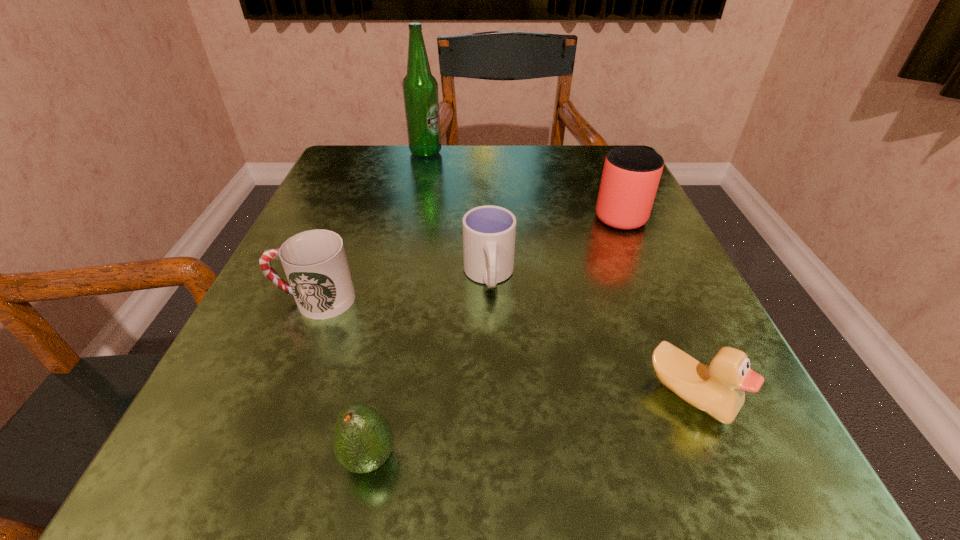
Locate an element on the screen. duck positioned at the right edge is located at coordinates (718, 390).

You are a GUI agent. You are given a task and a screenshot of the screen. Output one action in this format:
    pyautogui.click(x=<x>, y=<y>)
    Task: Click on the object positioned at the far right corner
    
    Given the screenshot: What is the action you would take?
    pyautogui.click(x=631, y=174)

Find the location of a particular element. vacant space at the far edge of the desktop is located at coordinates (450, 192).

Image resolution: width=960 pixels, height=540 pixels. What are the coordinates of `vacant region at the near edge of the desktop` in the screenshot? It's located at (603, 447).

Where is `free space at the left edge`? This screenshot has width=960, height=540. free space at the left edge is located at coordinates point(358,318).

This screenshot has height=540, width=960. In order to click on free space at the right edge of the desktop in this screenshot , I will do `click(614, 356)`.

Locate an element on the screen. free space at the far left corner of the desktop is located at coordinates (396, 159).

In the image, there is a desktop. At what (x,y) coordinates should I click in order to perform the action: click on vacant area at the near left corner. Please return your answer as a coordinate pair (x, y). Looking at the image, I should click on (290, 509).

The width and height of the screenshot is (960, 540). I want to click on free space that is in between the nearest object and the leftmost object, so click(342, 379).

Image resolution: width=960 pixels, height=540 pixels. In order to click on empty location between the tallest cup and the beer bottle in this screenshot , I will do `click(522, 183)`.